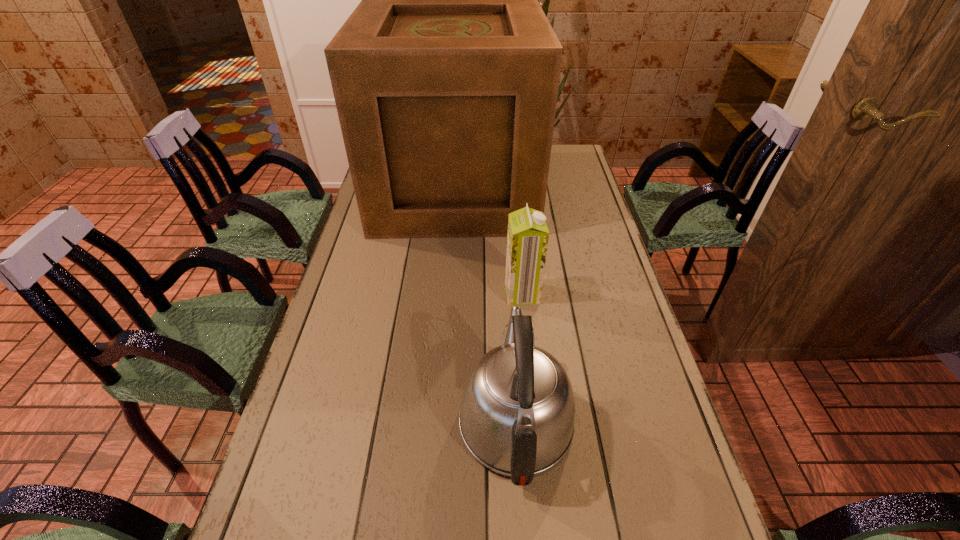
Find the location of `object located at the left edge`. object located at the left edge is located at coordinates (445, 77).

Find the location of a particular element. object located in the far left corner section of the desktop is located at coordinates (445, 77).

Where is `free spot at the left edge of the desktop`? free spot at the left edge of the desktop is located at coordinates coord(374,297).

The image size is (960, 540). What are the coordinates of `free space at the right edge of the desktop` in the screenshot? It's located at tap(581, 242).

At what (x,y) coordinates should I click in order to perform the action: click on empty space that is in between the kettle and the box. Please return your answer as a coordinate pair (x, y). This screenshot has height=540, width=960. Looking at the image, I should click on (486, 305).

Find the location of `blank region between the second farthest object and the tallest object`. blank region between the second farthest object and the tallest object is located at coordinates (489, 242).

Select which object is the closest to the farthest object. Please provide its 2D coordinates. Your answer should be formatted as a tuple, i.e. [(x, y)], where the tuple contains the x and y coordinates of a point satisfying the conditions above.

[(527, 240)]

Identify which object is located as the second nearest to the soya milk. Please provide its 2D coordinates. Your answer should be formatted as a tuple, i.e. [(x, y)], where the tuple contains the x and y coordinates of a point satisfying the conditions above.

[(445, 77)]

Locate an element on the screen. The width and height of the screenshot is (960, 540). free space that satisfies the following two spatial constraints: 1. on the spout of the kettle; 2. on the right side of the second farthest object is located at coordinates (508, 293).